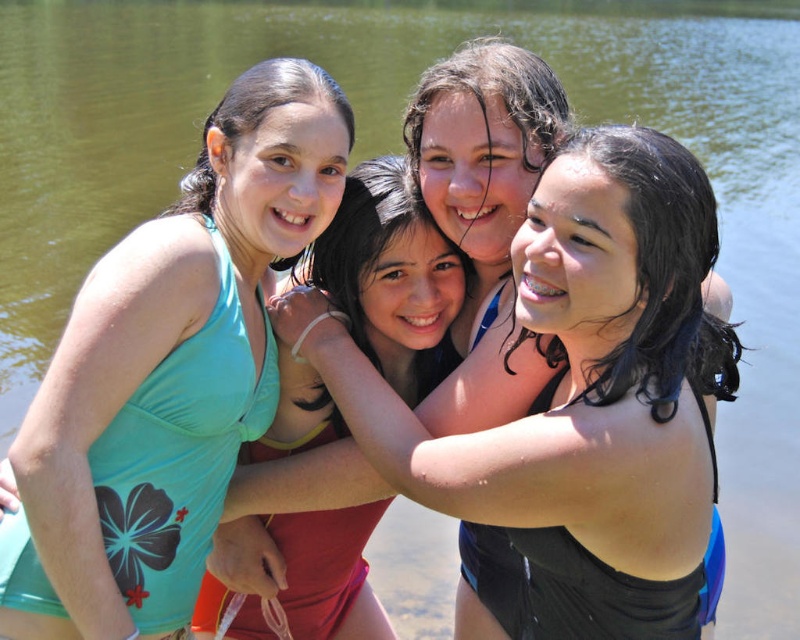
You are a photographer trying to capture a photo of the matte black swimsuit at center and the light blue fabric swimsuit at upper left. Based on their heights, which swimwear should you focus on to ensure it appears larger in the photo?

The light blue fabric swimsuit at upper left has a greater height than the matte black swimsuit at center, so focusing on it would make it appear larger in the photo.

You are standing in front of the group of girls by the water. Which girl is nearer to you, the one in the matte black swimsuit at center or the light blue fabric swimsuit at upper left?

The matte black swimsuit at center is closer to the viewer than the light blue fabric swimsuit at upper left, so the girl in the matte black swimsuit at center is nearer to you.